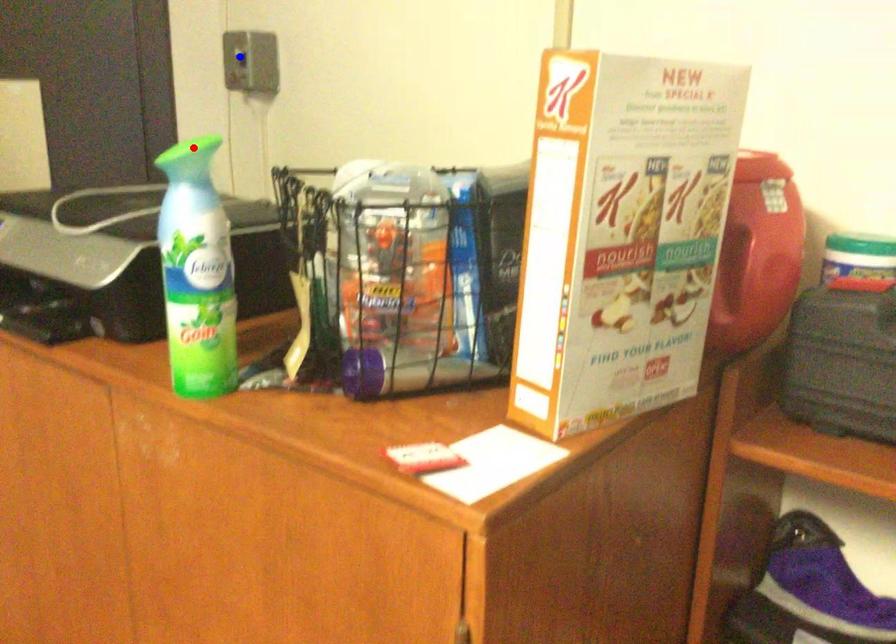
Question: Which of the two points in the image is closer to the camera?

Choices:
 (A) Blue point is closer.
 (B) Red point is closer.

Answer: (B)